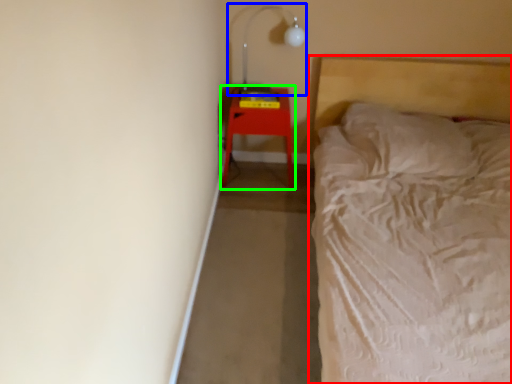
Question: Estimate the real-world distances between objects in this image. Which object is farther from bed (highlighted by a red box), lamp (highlighted by a blue box) or furniture (highlighted by a green box)?

Choices:
 (A) lamp
 (B) furniture

Answer: (A)